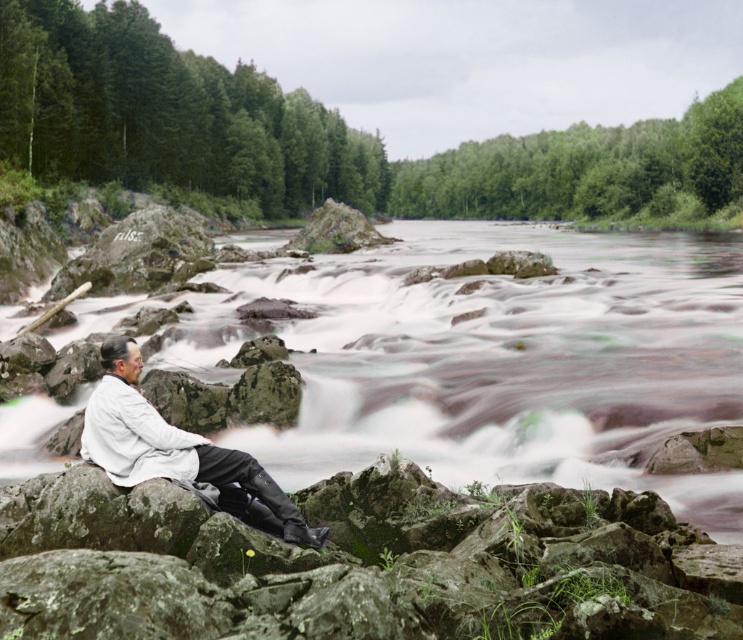
Does white frothy water at center have a lesser width compared to white matte shirt at lower left?

In fact, white frothy water at center might be wider than white matte shirt at lower left.

Is white frothy water at center bigger than white matte shirt at lower left?

Yes.

Image resolution: width=743 pixels, height=640 pixels. I want to click on white frothy water at center, so click(490, 358).

Find the location of a particular element. Image resolution: width=743 pixels, height=640 pixels. white frothy water at center is located at coordinates (490, 358).